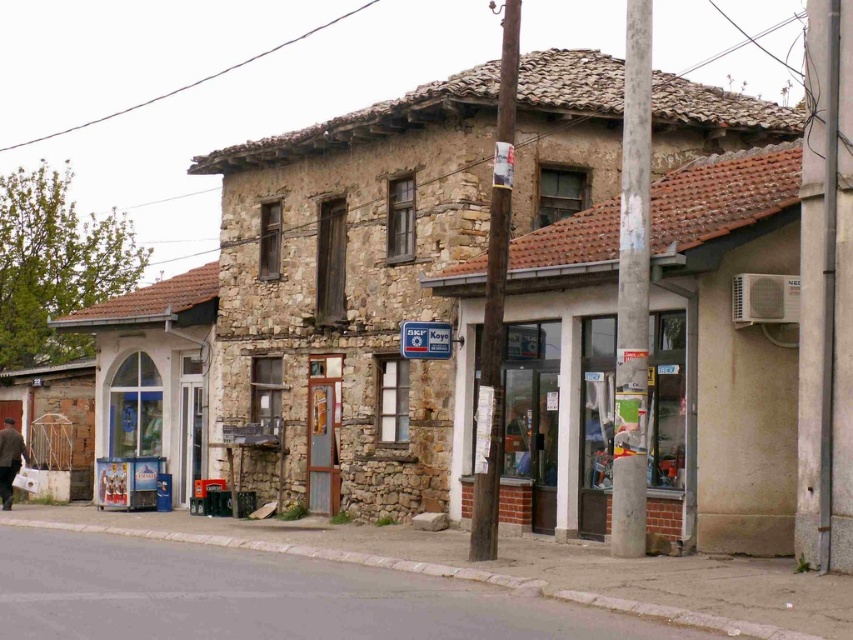
Between point (511, 400) and point (9, 458), which one is positioned in front?

Positioned in front is point (511, 400).

Is clear glass door at center positioned behind brown wool coat at lower left?

No, it is in front of brown wool coat at lower left.

Which is behind, point (665, 372) or point (3, 461)?

Point (3, 461)

The width and height of the screenshot is (853, 640). What are the coordinates of `clear glass door at center` in the screenshot? It's located at point(560,413).